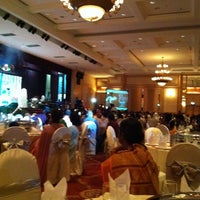
The width and height of the screenshot is (200, 200). Find the location of `back of chiars grey`. back of chiars grey is located at coordinates (184, 165), (28, 168), (62, 145), (16, 142), (90, 131).